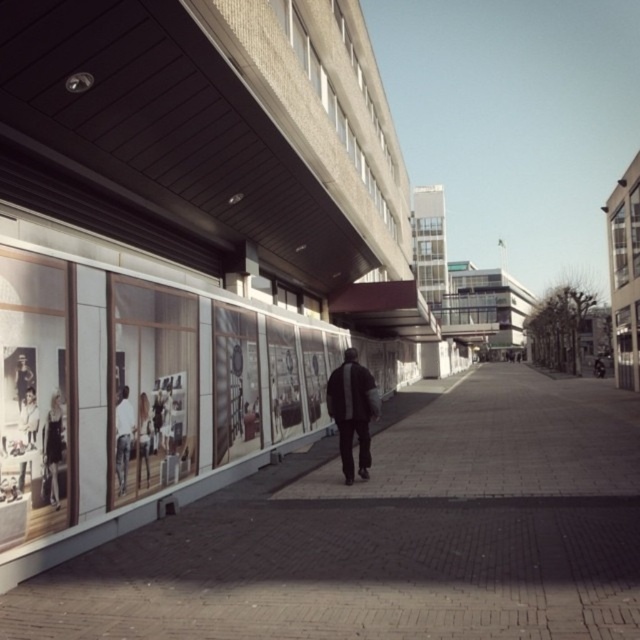
Between white paper at lower left and matte black figure at lower left, which one appears on the right side from the viewer's perspective?

matte black figure at lower left is more to the right.

Who is shorter, white paper at lower left or matte black figure at lower left?

Standing shorter between the two is white paper at lower left.

Between point (32, 440) and point (145, 465), which one is positioned in front?

Positioned in front is point (32, 440).

You are a GUI agent. You are given a task and a screenshot of the screen. Output one action in this format:
    pyautogui.click(x=<x>, y=<y>)
    Task: Click on the white paper at lower left
    The width and height of the screenshot is (640, 640).
    Given the screenshot: What is the action you would take?
    pyautogui.click(x=28, y=419)

Which of these two, matte black jacket at left or white fabric at left, stands shorter?

matte black jacket at left is shorter.

Based on the photo, who is more forward, (56, 508) or (122, 472)?

Point (56, 508) is more forward.

This screenshot has width=640, height=640. Identify the location of matte black jacket at left. (52, 448).

Where is `matte black jacket at left`? matte black jacket at left is located at coordinates (52, 448).

Consider the image. Between brick pavement at center and white fabric at left, which one appears on the right side from the viewer's perspective?

brick pavement at center

Which of these two, brick pavement at center or white fabric at left, stands shorter?

white fabric at left

Measure the distance between brick pavement at center and camera.

They are 3.75 meters apart.

The width and height of the screenshot is (640, 640). Find the location of `brick pavement at center`. brick pavement at center is located at coordinates (390, 532).